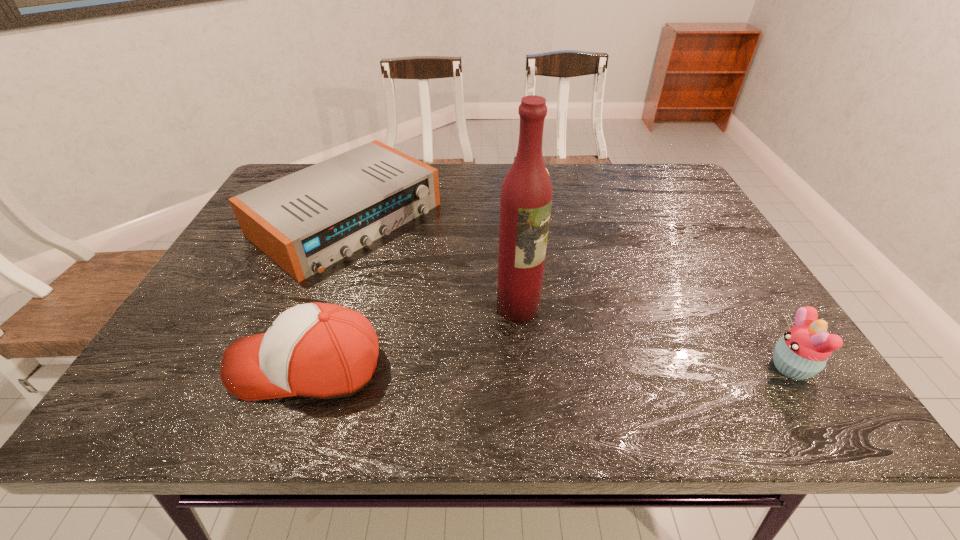
Identify the location of vacant space located 0.370m on the face of the rightmost object. The width and height of the screenshot is (960, 540). (580, 367).

Locate an element on the screen. The image size is (960, 540). vacant point located 0.180m on the face of the rightmost object is located at coordinates (677, 367).

This screenshot has height=540, width=960. I want to click on free space located on the front panel of the radio receiver, so click(x=440, y=281).

This screenshot has height=540, width=960. In order to click on vacant space located on the front panel of the radio receiver in this screenshot , I will do `click(476, 306)`.

This screenshot has width=960, height=540. Identify the location of free space located on the front panel of the radio receiver. (473, 303).

Locate an element on the screen. This screenshot has width=960, height=540. free space located at the beak of the duck is located at coordinates click(537, 249).

Find the location of a particular element. This screenshot has width=960, height=540. free location located 0.190m at the beak of the duck is located at coordinates (539, 267).

The width and height of the screenshot is (960, 540). What are the coordinates of `free space located 0.240m at the beak of the duck` in the screenshot? It's located at (540, 281).

Where is `vacant space located 0.140m on the label of the liquor`? vacant space located 0.140m on the label of the liquor is located at coordinates [x=588, y=354].

The image size is (960, 540). I want to click on free space located on the label of the liquor, so click(553, 330).